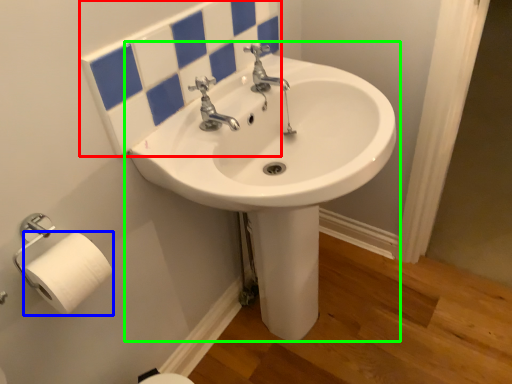
Question: Estimate the real-world distances between objects in this image. Which object is closer to mirror (highlighted by a red box), toilet paper (highlighted by a blue box) or sink (highlighted by a green box)?

Choices:
 (A) toilet paper
 (B) sink

Answer: (B)